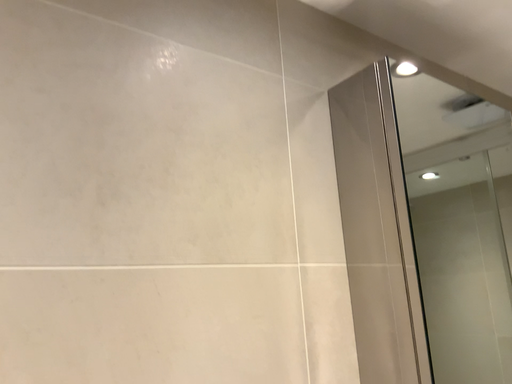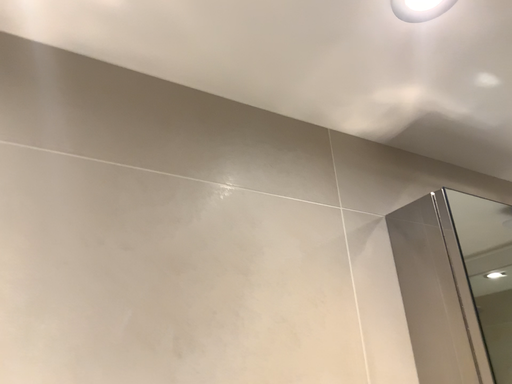
Question: How did the camera likely rotate when shooting the video?

Choices:
 (A) rotated upward
 (B) rotated downward

Answer: (A)